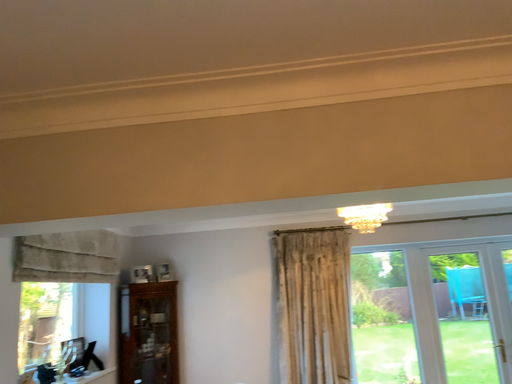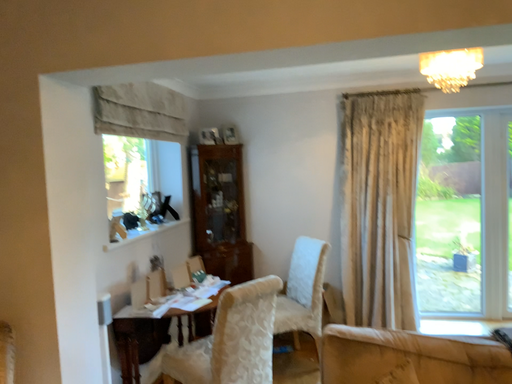
Question: How did the camera likely rotate when shooting the video?

Choices:
 (A) rotated downward
 (B) rotated upward

Answer: (A)